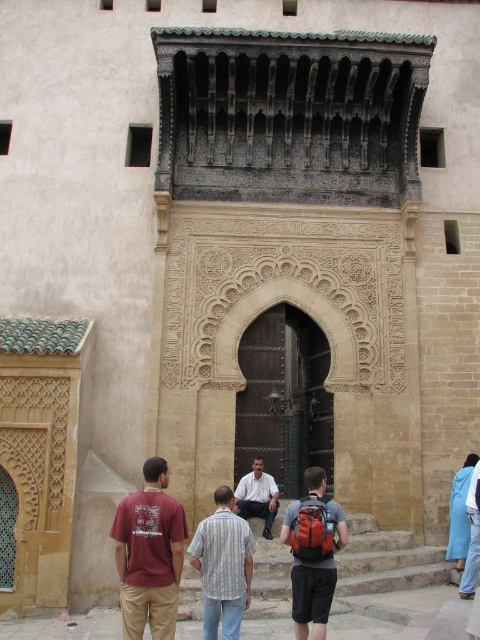
Looking at this image, you are standing in front of the building and notice an orange fabric backpack at center and a blue fabric at lower right. Which object is taller?

The orange fabric backpack at center is taller than the blue fabric at lower right.

You are an architect visiting this historic building and need to determine the spatial relationship between the dark wood door at center and the blue fabric at lower right. Based on the scene, which object occupies a higher vertical position?

The dark wood door at center is taller than blue fabric at lower right, so the dark wood door at center is positioned higher vertically.

You are an architect designing a new building inspired by the image. You need to ensure that the dark wood door at center and the striped cotton shirt at center are placed in a way that maintains their relative sizes as shown. Which object should be made smaller in your design?

The dark wood door at center should be made smaller than the striped cotton shirt at center because the description states that the dark wood door at center has a lesser width compared to striped cotton shirt at center.